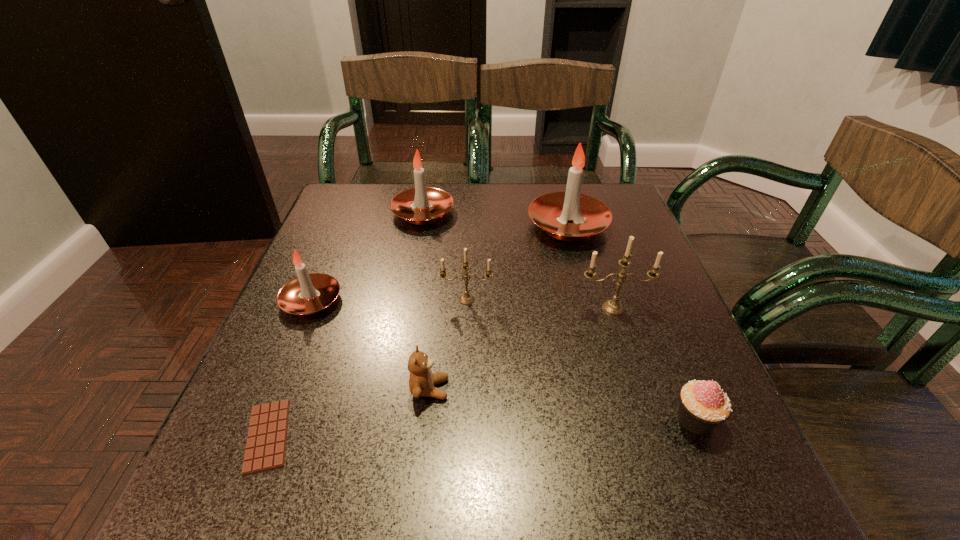
Where is `free space that is in between the leftmost white candle and the second smallest white candle`? The image size is (960, 540). free space that is in between the leftmost white candle and the second smallest white candle is located at coordinates (368, 257).

Identify the location of free spot between the left metallic candle and the rightmost white candle. (517, 262).

This screenshot has height=540, width=960. What are the coordinates of `free space between the candy bar and the smaller metallic candle` in the screenshot? It's located at (368, 368).

Find the location of a particular element. Image resolution: width=960 pixels, height=540 pixels. unoccupied position between the cupcake and the bigger metallic candle is located at coordinates (654, 363).

Where is `free spot between the bigger metallic candle and the shortest object`? free spot between the bigger metallic candle and the shortest object is located at coordinates (441, 372).

This screenshot has width=960, height=540. I want to click on free space between the teddy bear and the shortest object, so click(348, 413).

Where is `free area in between the leftmost white candle and the teddy bear`? The image size is (960, 540). free area in between the leftmost white candle and the teddy bear is located at coordinates (371, 345).

Identify the location of empty location between the bigger metallic candle and the brown candy bar. (441, 372).

Locate an element on the screen. object that is the third nearest to the candy bar is located at coordinates (466, 299).

Select which object appears as the fourth closest to the brown candy bar. Please provide its 2D coordinates. Your answer should be formatted as a tuple, i.e. [(x, y)], where the tuple contains the x and y coordinates of a point satisfying the conditions above.

[(421, 205)]